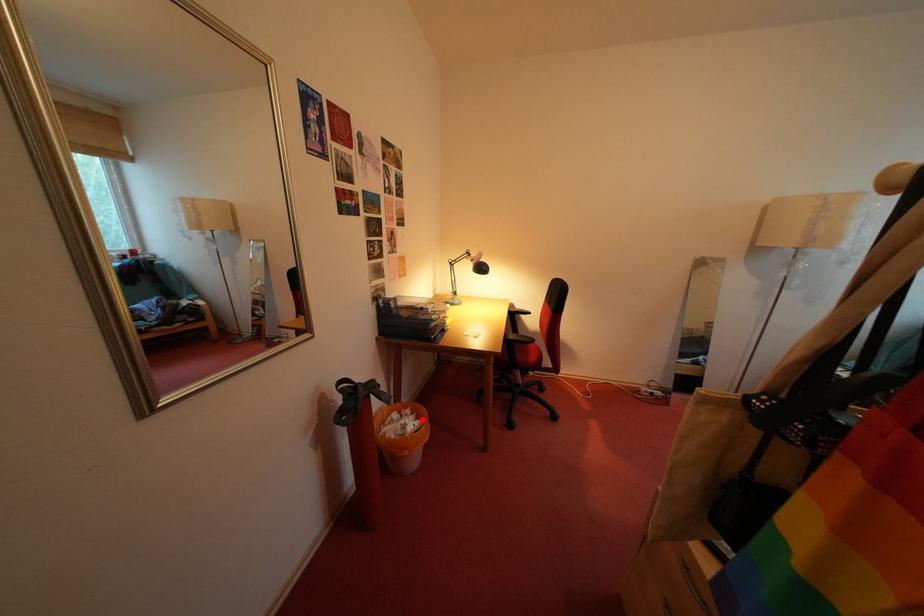
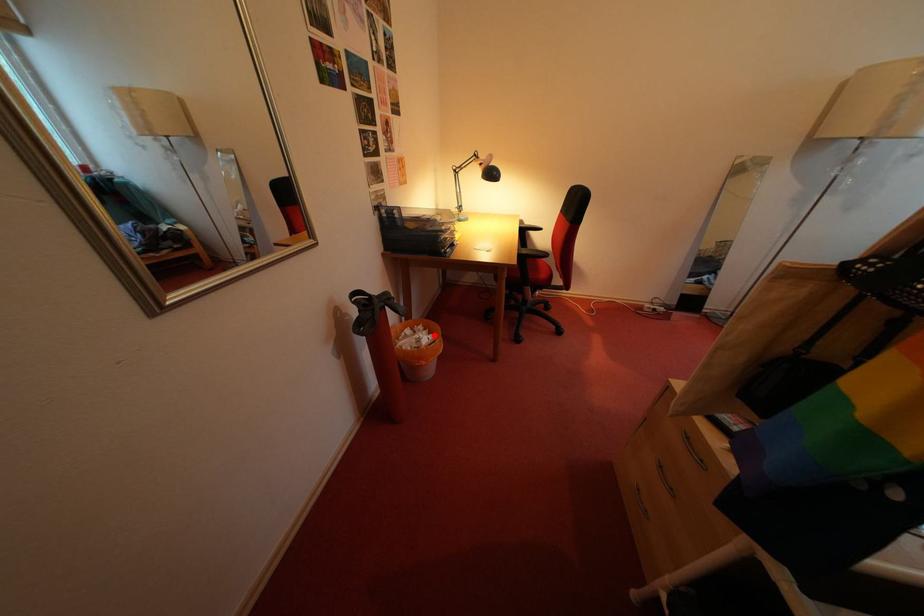
I am providing you with two images of the same scene from different viewpoints. A red point is marked on the first image and another point is marked on the second image. Do the highlighted points in image1 and image2 indicate the same real-world spot?

Yes